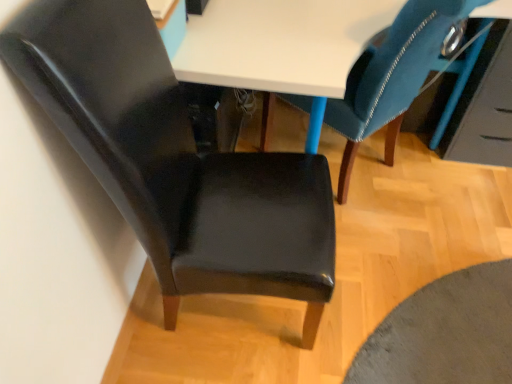
Question: Can you confirm if velvet blue chair at upper right, the 1th chair when ordered from right to left, is thinner than matte black chair at left, acting as the first chair starting from the left?

Choices:
 (A) no
 (B) yes

Answer: (A)

Question: Does velvet blue chair at upper right, the 1th chair when ordered from right to left, come in front of matte black chair at left, acting as the first chair starting from the left?

Choices:
 (A) yes
 (B) no

Answer: (B)

Question: Is matte black chair at left, marked as the 2th chair in a right-to-left arrangement, at the back of velvet blue chair at upper right, which is counted as the second chair, starting from the left?

Choices:
 (A) yes
 (B) no

Answer: (B)

Question: Considering the relative sizes of velvet blue chair at upper right, the 1th chair when ordered from right to left, and matte black chair at left, marked as the 2th chair in a right-to-left arrangement, in the image provided, is velvet blue chair at upper right, the 1th chair when ordered from right to left, taller than matte black chair at left, marked as the 2th chair in a right-to-left arrangement,?

Choices:
 (A) no
 (B) yes

Answer: (A)

Question: Does velvet blue chair at upper right, the 1th chair when ordered from right to left, turn towards matte black chair at left, marked as the 2th chair in a right-to-left arrangement?

Choices:
 (A) no
 (B) yes

Answer: (A)

Question: From the image's perspective, is velvet blue chair at upper right, the 1th chair when ordered from right to left, above matte black chair at left, acting as the first chair starting from the left?

Choices:
 (A) yes
 (B) no

Answer: (A)

Question: Considering the relative sizes of velvet blue chair at upper right, the 1th chair when ordered from right to left, and glossy blue drawer at upper right in the image provided, is velvet blue chair at upper right, the 1th chair when ordered from right to left, wider than glossy blue drawer at upper right?

Choices:
 (A) no
 (B) yes

Answer: (B)

Question: Can glossy blue drawer at upper right be found inside velvet blue chair at upper right, which is counted as the second chair, starting from the left?

Choices:
 (A) yes
 (B) no

Answer: (B)

Question: Is velvet blue chair at upper right, which is counted as the second chair, starting from the left, positioned beyond the bounds of glossy blue drawer at upper right?

Choices:
 (A) yes
 (B) no

Answer: (A)

Question: Is velvet blue chair at upper right, the 1th chair when ordered from right to left, thinner than glossy blue drawer at upper right?

Choices:
 (A) no
 (B) yes

Answer: (A)

Question: Are velvet blue chair at upper right, which is counted as the second chair, starting from the left, and glossy blue drawer at upper right located far from each other?

Choices:
 (A) no
 (B) yes

Answer: (A)

Question: Does velvet blue chair at upper right, the 1th chair when ordered from right to left, have a larger size compared to glossy blue drawer at upper right?

Choices:
 (A) no
 (B) yes

Answer: (B)

Question: Does glossy blue drawer at upper right have a larger size compared to matte black chair at left, acting as the first chair starting from the left?

Choices:
 (A) no
 (B) yes

Answer: (A)